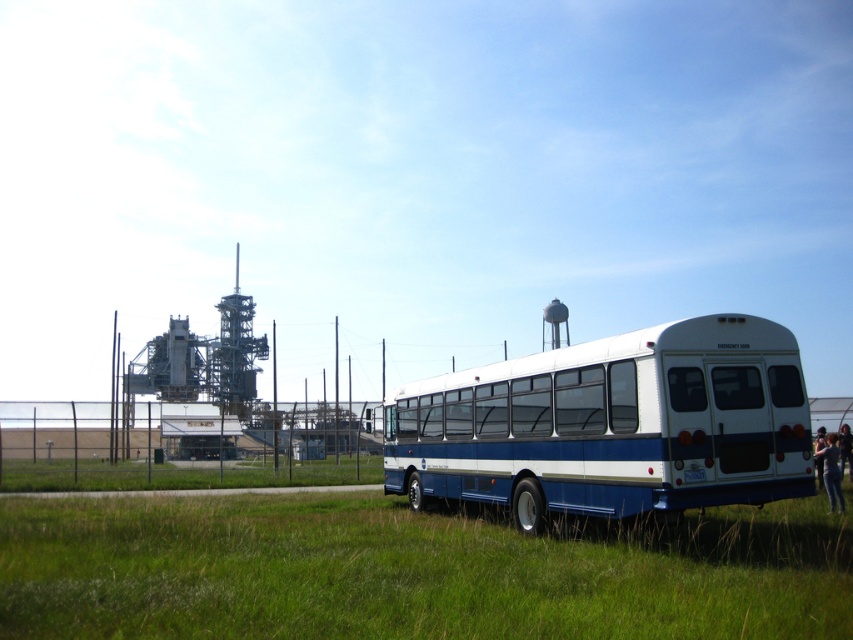
Question: Which point is farther from the camera taking this photo?

Choices:
 (A) (689, 520)
 (B) (405, 422)

Answer: (B)

Question: Can you confirm if green grass at lower center is bigger than white matte bus at right?

Choices:
 (A) no
 (B) yes

Answer: (A)

Question: Is green grass at lower center positioned in front of white matte bus at right?

Choices:
 (A) yes
 (B) no

Answer: (A)

Question: Does green grass at lower center appear on the left side of white matte bus at right?

Choices:
 (A) no
 (B) yes

Answer: (B)

Question: Which object appears closest to the camera in this image?

Choices:
 (A) white matte bus at right
 (B) green grass at lower center

Answer: (B)